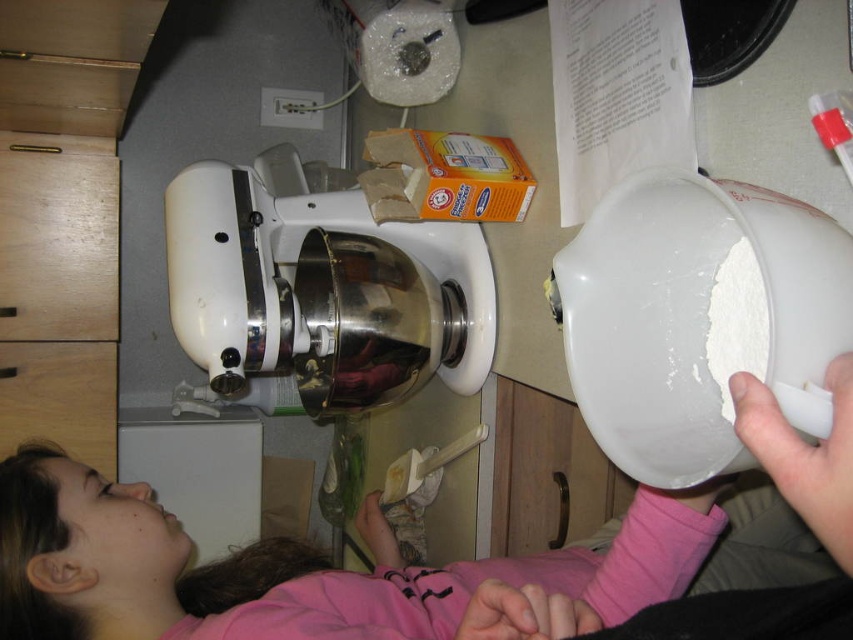
You are standing at the point marked by coordinates point (322,291) in the kitchen scene. What object is located exactly at that point?

The white glossy mixer at center is located exactly at point (322,291).

You are a baker trying to reach the wooden drawer at lower left. Can you open it without moving the white glossy mixer at center?

The white glossy mixer at center is positioned over the wooden drawer at lower left, so you cannot open the wooden drawer at lower left without moving the white glossy mixer at center first.

You are a chef in the kitchen and need to store some baking tools. You have a wooden item and a wooden drawer. According to the image, where is the wooden at left relative to the wooden drawer at lower left?

The wooden at left is located above the wooden drawer at lower left.